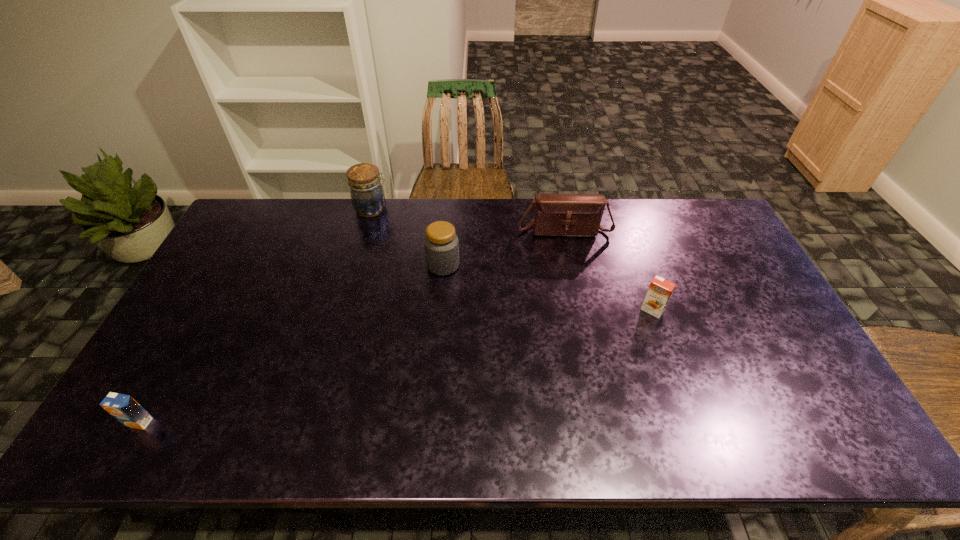
Find the location of `the farther jar`. the farther jar is located at coordinates (367, 195).

Locate an element on the screen. The width and height of the screenshot is (960, 540). the farthest object is located at coordinates (367, 195).

What are the coordinates of `shoulder bag` in the screenshot? It's located at (555, 214).

You are a GUI agent. You are given a task and a screenshot of the screen. Output one action in this format:
    pyautogui.click(x=<x>, y=<y>)
    Task: Click on the second object from right to left
    
    Given the screenshot: What is the action you would take?
    pyautogui.click(x=555, y=214)

Find the location of `the third farthest object`. the third farthest object is located at coordinates (441, 243).

Locate an element on the screen. the right jar is located at coordinates [x=441, y=243].

The width and height of the screenshot is (960, 540). What are the coordinates of `the right orange_juice` in the screenshot? It's located at (659, 292).

Identify the location of the fourth farthest object. click(x=659, y=292).

I want to click on the leftmost object, so click(124, 408).

I want to click on the left orange_juice, so click(x=124, y=408).